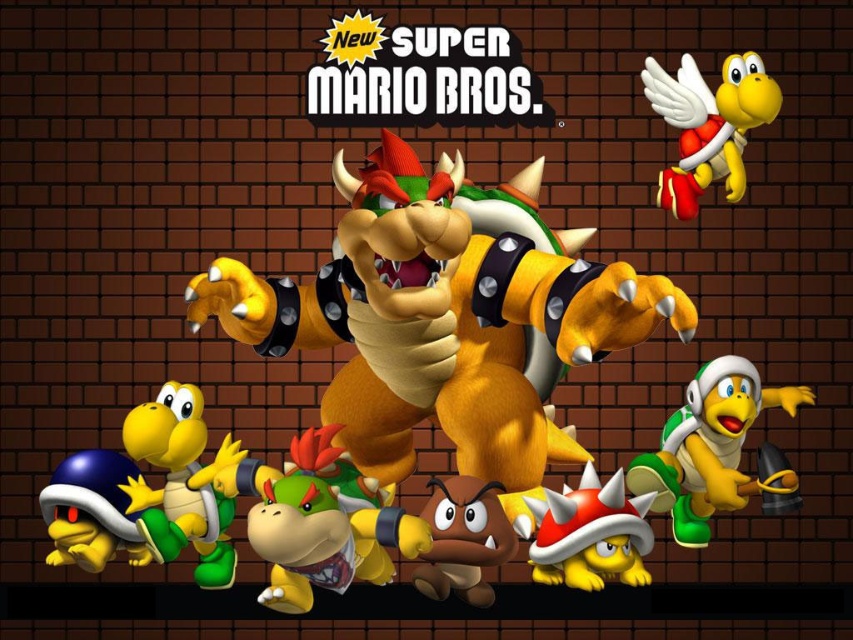
In the New Super Mario Bros. game scene, you see a brown rubber turtle at center and a green rubber koopa troopa at center. Which one is taller?

The brown rubber turtle at center is much taller than the green rubber koopa troopa at center.